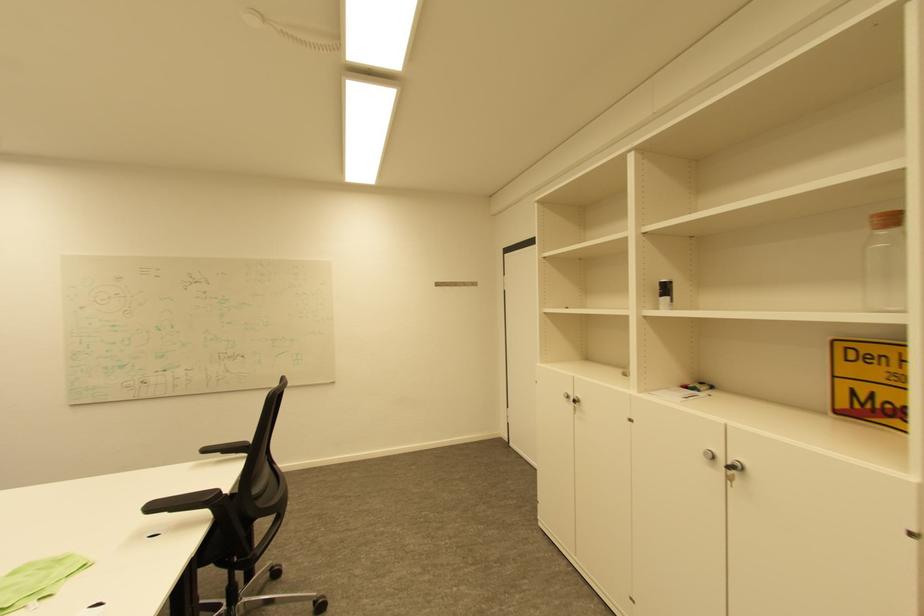
Find the location of a particular element. Image resolution: width=924 pixels, height=616 pixels. cork bottle stopper is located at coordinates (886, 219).